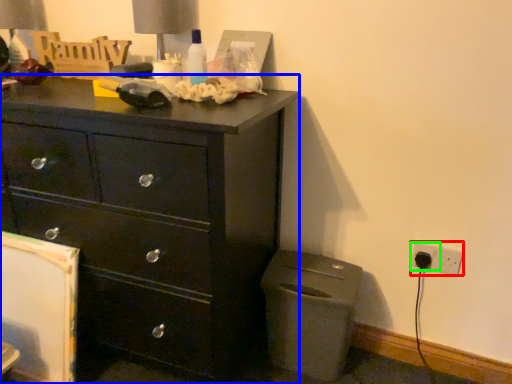
Question: Which is farther away from electric outlet (highlighted by a red box)? chest of drawers (highlighted by a blue box) or electric outlet (highlighted by a green box)?

Choices:
 (A) chest of drawers
 (B) electric outlet

Answer: (A)